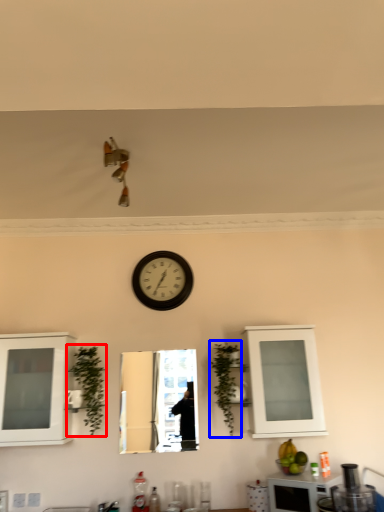
Question: Among these objects, which one is farthest to the camera, plant (highlighted by a red box) or plant (highlighted by a blue box)?

Choices:
 (A) plant
 (B) plant

Answer: (B)